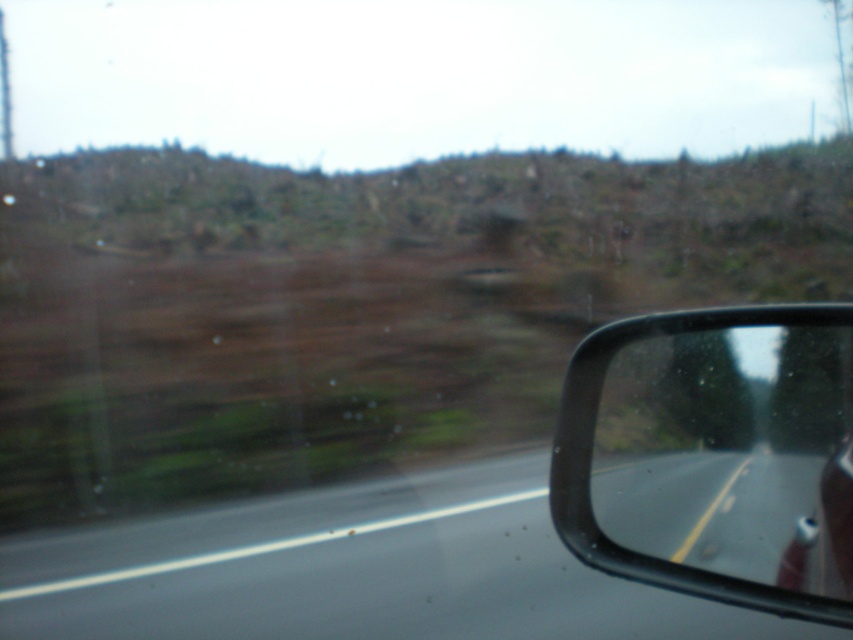
Is smooth asphalt road at center above black plastic mirror at right?

No.

Looking at this image, is smooth asphalt road at center to the left of black plastic mirror at right from the viewer's perspective?

Yes, smooth asphalt road at center is to the left of black plastic mirror at right.

Is point (41, 584) farther from viewer compared to point (798, 358)?

Yes, it is.

Image resolution: width=853 pixels, height=640 pixels. In order to click on smooth asphalt road at center in this screenshot , I will do (x=352, y=572).